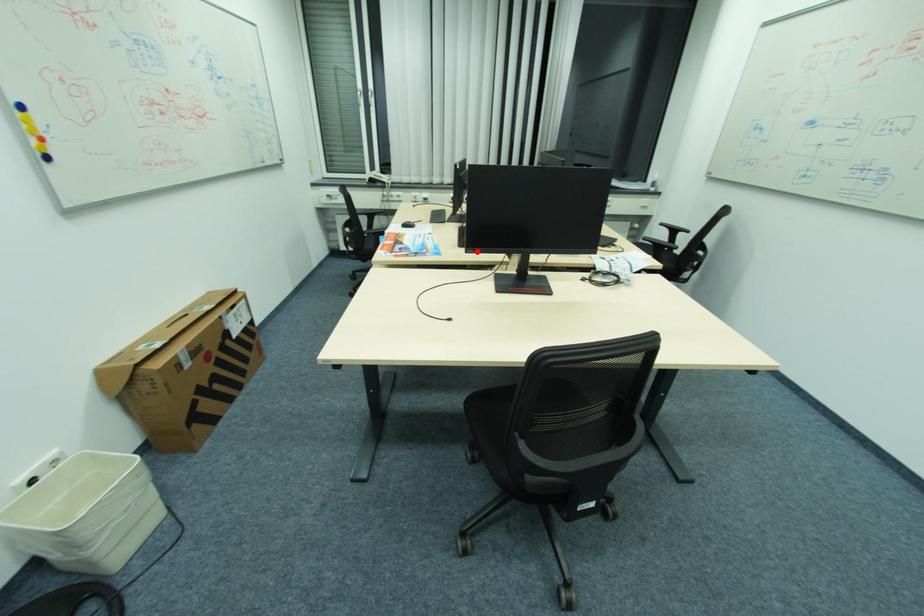
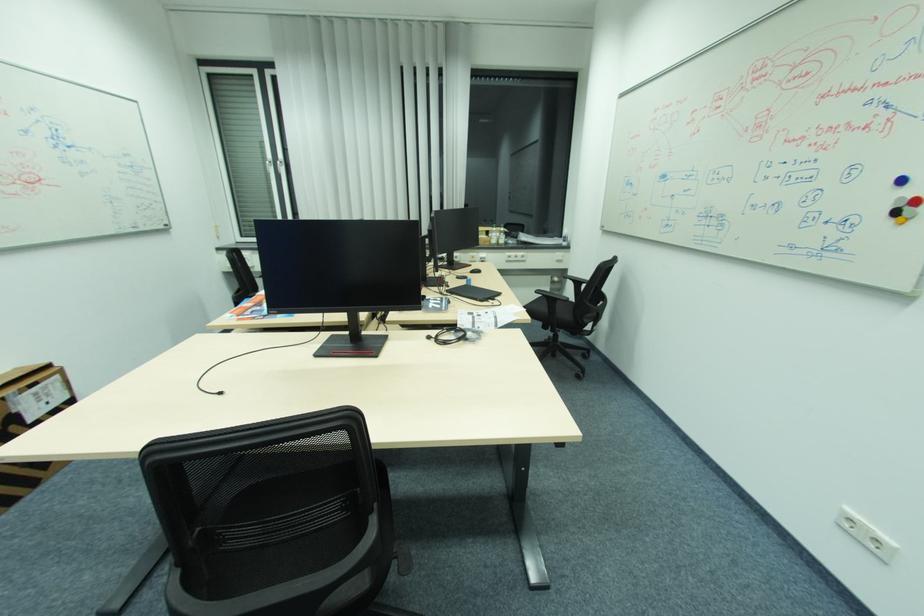
Question: I am providing you with two images of the same scene from different viewpoints. A red point is shown in image1. For the corresponding object point in image2, is it positioned nearer or farther from the camera?

Choices:
 (A) Nearer
 (B) Farther

Answer: (B)